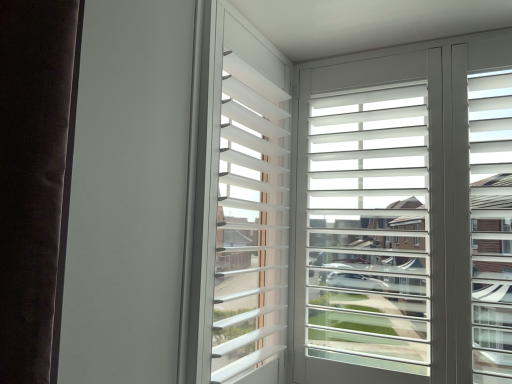
Question: From a real-world perspective, relative to white matte blinds at center, is white matte window screen at upper right vertically above or below?

Choices:
 (A) above
 (B) below

Answer: (B)

Question: In terms of size, does white matte window screen at upper right appear bigger or smaller than white matte blinds at center?

Choices:
 (A) big
 (B) small

Answer: (A)

Question: Considering the positions of white matte window screen at upper right and white matte blinds at center in the image, is white matte window screen at upper right wider or thinner than white matte blinds at center?

Choices:
 (A) thin
 (B) wide

Answer: (A)

Question: Is white matte blinds at center spatially inside white matte window screen at upper right, or outside of it?

Choices:
 (A) outside
 (B) inside

Answer: (A)

Question: Looking at their shapes, would you say white matte blinds at center is wider or thinner than white matte window screen at upper right?

Choices:
 (A) wide
 (B) thin

Answer: (A)

Question: From the image's perspective, is white matte blinds at center above or below white matte window screen at upper right?

Choices:
 (A) above
 (B) below

Answer: (A)

Question: Is white matte blinds at center to the left or to the right of white matte window screen at upper right in the image?

Choices:
 (A) left
 (B) right

Answer: (A)